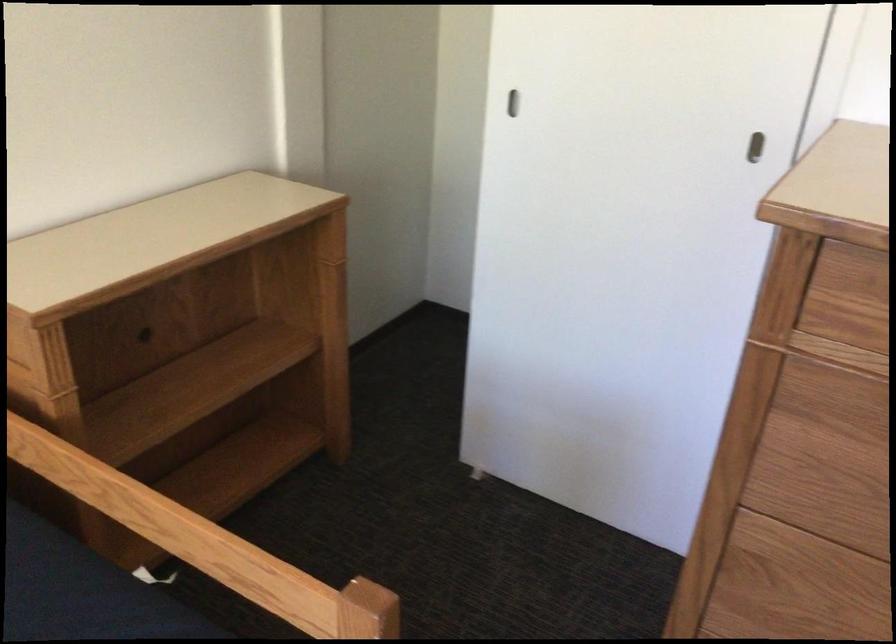
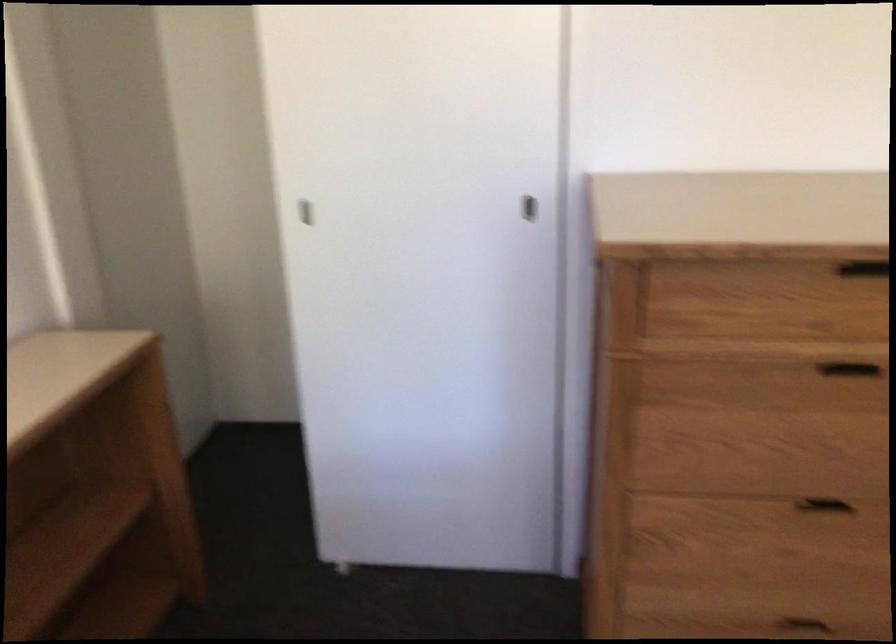
Question: The camera is either moving clockwise (left) or counter-clockwise (right) around the object. The first image is from the beginning of the video and the second image is from the end. Is the camera moving left or right when shooting the video?

Choices:
 (A) Left
 (B) Right

Answer: (A)